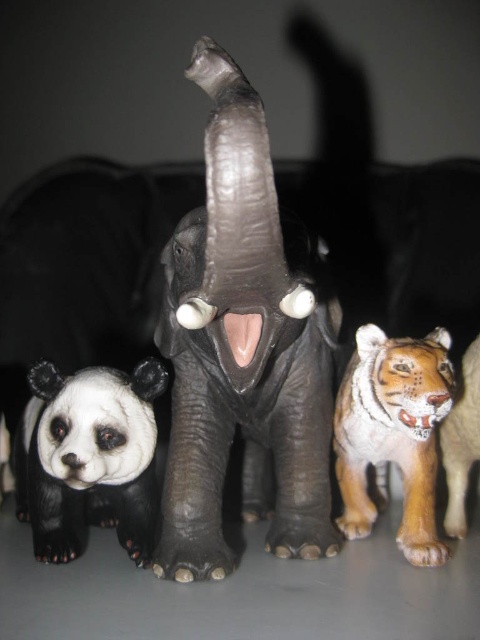
You are standing at the point marked by the coordinates point (241, 349) in the image. Looking around, you see a large elephant toy with dark gray skin and white tusks, a panda bear toy, and a tiger toy. Which animal are you currently standing closest to?

You are currently standing closest to the black matte painted panda at center left because the point 0.548 0.504 marks its location.